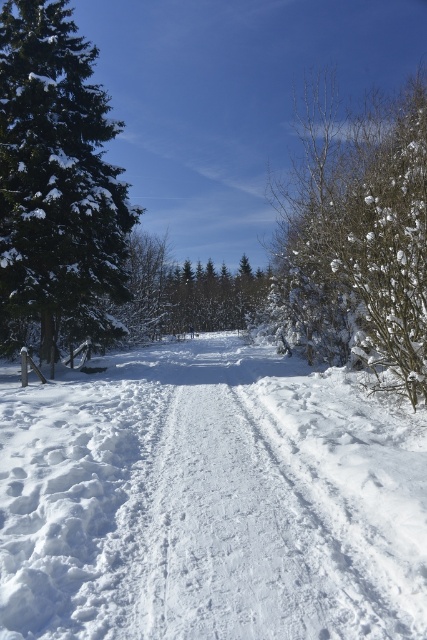
Does snow-covered branches at right have a larger size compared to green textured pine tree at left?

Indeed, snow-covered branches at right has a larger size compared to green textured pine tree at left.

Who is positioned more to the right, snow-covered branches at right or green textured pine tree at left?

snow-covered branches at right is more to the right.

Is point (298, 333) behind point (94, 93)?

Yes, it is behind point (94, 93).

The width and height of the screenshot is (427, 640). In order to click on snow-covered branches at right in this screenshot , I will do `click(359, 236)`.

Does green textured pine tree at left appear under green matte tree at center?

No, green textured pine tree at left is not below green matte tree at center.

How much distance is there between green textured pine tree at left and green matte tree at center?

green textured pine tree at left is 10.03 meters from green matte tree at center.

Between point (47, 84) and point (160, 332), which one is positioned behind?

The point (160, 332) is more distant.

Where is `green textured pine tree at left`? The width and height of the screenshot is (427, 640). green textured pine tree at left is located at coordinates (56, 186).

Measure the distance between snow-covered branches at right and green matte tree at center.

10.71 meters

I want to click on snow-covered branches at right, so click(x=359, y=236).

Is point (388, 188) behind point (245, 301)?

No, (388, 188) is closer to viewer.

The height and width of the screenshot is (640, 427). I want to click on snow-covered branches at right, so click(x=359, y=236).